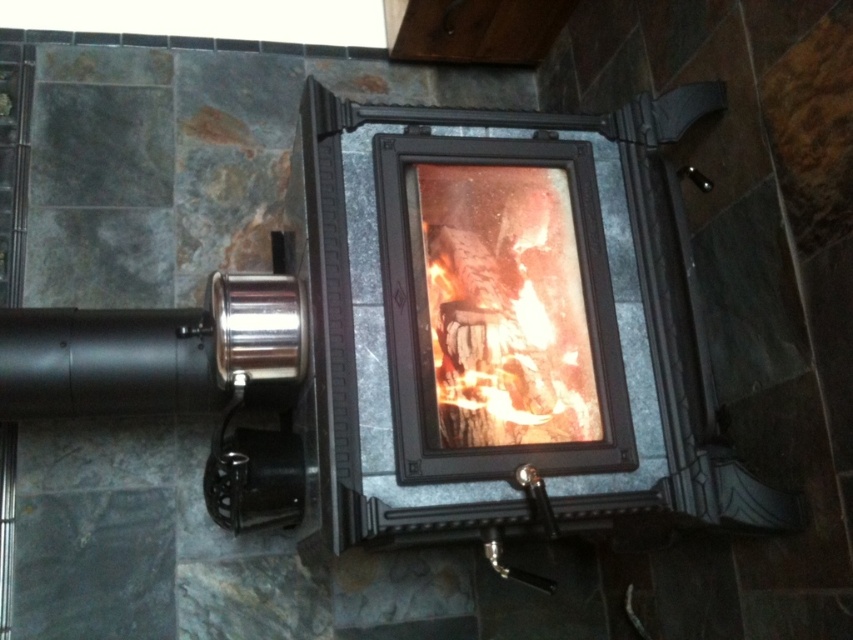
You are standing in front of the modern wood burning stove. You want to place a new piece of wood into the stove. Which object, the matte black fireplace at center or the orange glowing wood at center, is the correct place to put the wood?

The orange glowing wood at center is the correct place to put the wood since it is the active fire area where new wood would be added, while the matte black fireplace at center is the structure itself.

You are designing a living room layout and want to place a sofa in front of the matte black fireplace at center. Considering the size of the orange glowing wood at center, will the sofa obstruct the view of the flames from the sofa?

The matte black fireplace at center has a larger size compared to orange glowing wood at center, so placing a sofa in front of it would likely obstruct the view of the flames from the sofa since the fireplace is bigger than the wood.